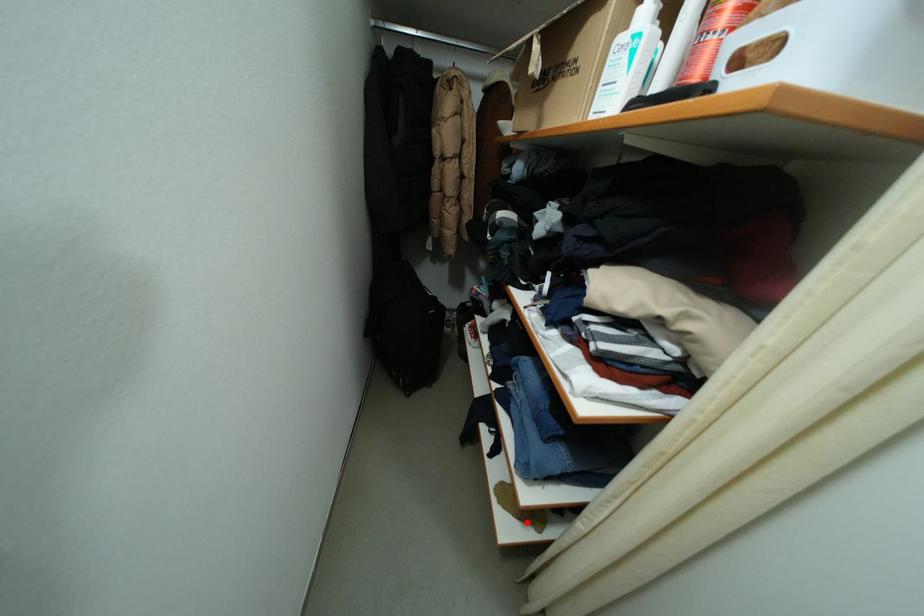
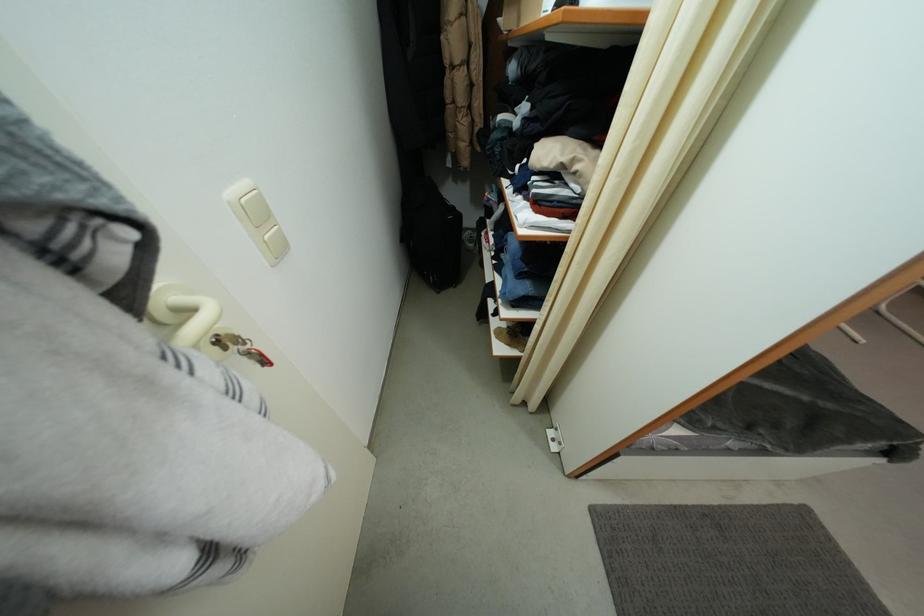
Where in the second image is the point corresponding to the highlighted location from the first image?

(517, 347)